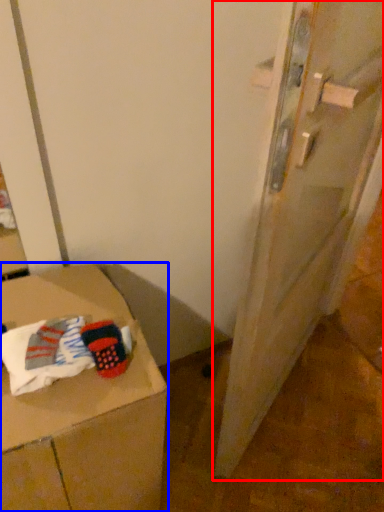
Question: Which object is further to the camera taking this photo, door (highlighted by a red box) or furniture (highlighted by a blue box)?

Choices:
 (A) door
 (B) furniture

Answer: (B)